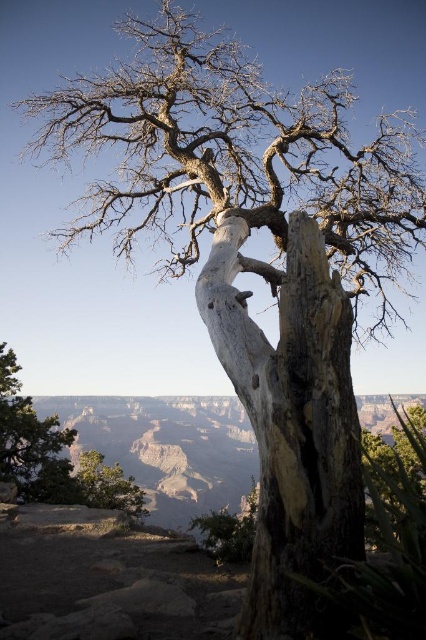
You are standing at the edge of the Grand Canyon and notice a point marked at coordinates (291,422). What object is located at that specific point?

The white textured bark at center is located at point (291,422).